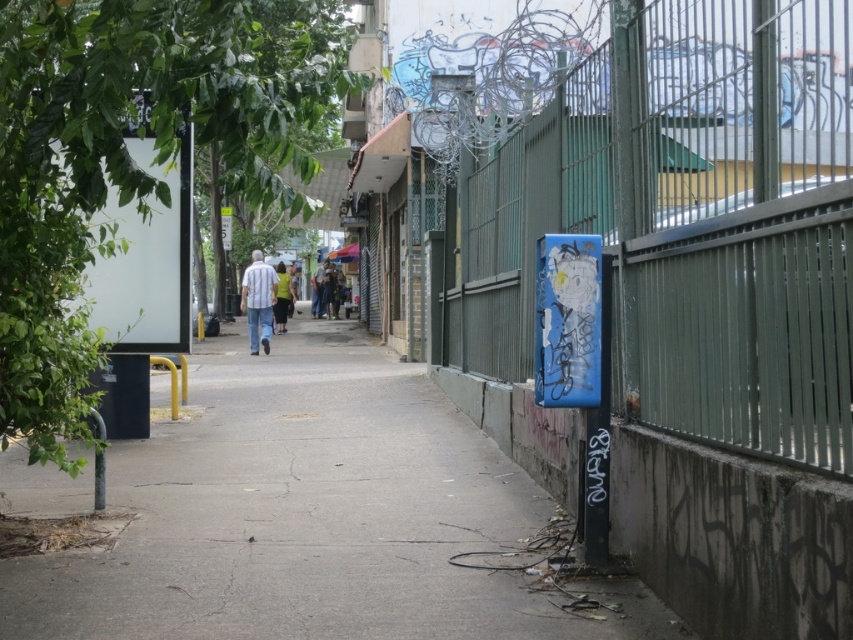
Question: Among these points, which one is nearest to the camera?

Choices:
 (A) (312, 308)
 (B) (378, 474)
 (C) (345, 248)
 (D) (263, 317)

Answer: (B)

Question: Based on their relative distances, which object is nearer to the striped fabric shirt at center?

Choices:
 (A) matte gray pants at center
 (B) yellow-green shirt at center
 (C) green metal fence at right
 (D) gray concrete pavement at center

Answer: (A)

Question: Can you confirm if striped fabric shirt at center is positioned above transparent plastic umbrella at center?

Choices:
 (A) no
 (B) yes

Answer: (A)

Question: Does matte gray pants at center have a lesser width compared to transparent plastic umbrella at center?

Choices:
 (A) yes
 (B) no

Answer: (B)

Question: Estimate the real-world distances between objects in this image. Which object is farther from the transparent plastic umbrella at center?

Choices:
 (A) striped fabric shirt at center
 (B) matte gray pants at center
 (C) gray concrete pavement at center
 (D) yellow-green shirt at center

Answer: (C)

Question: Does striped fabric shirt at center have a greater width compared to yellow-green shirt at center?

Choices:
 (A) no
 (B) yes

Answer: (B)